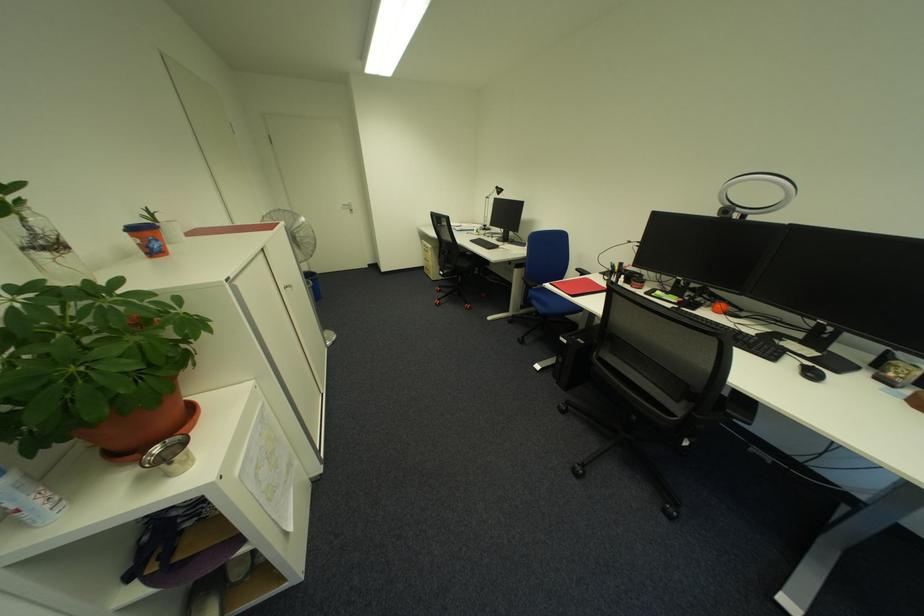
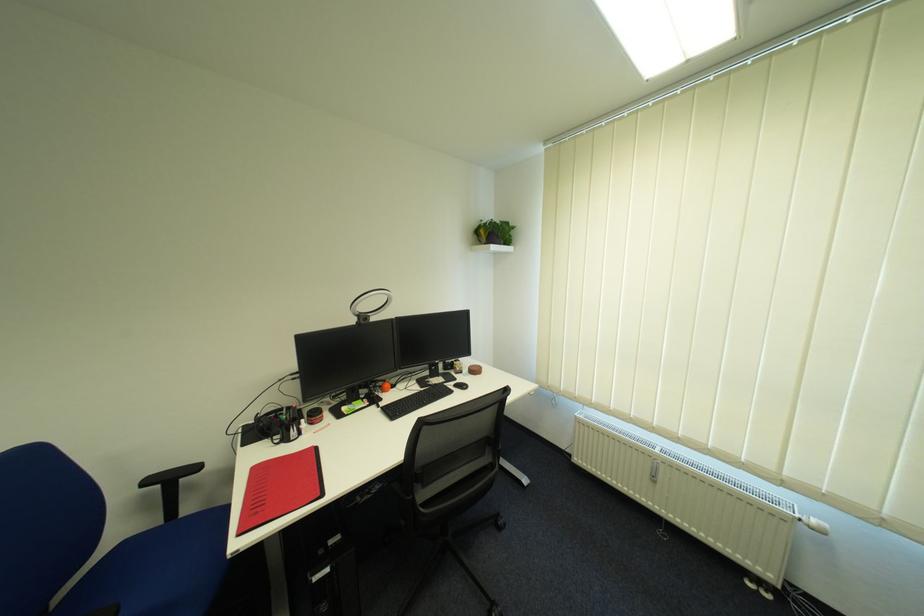
In the second image, find the point that corresponds to point (588, 270) in the first image.

(157, 483)